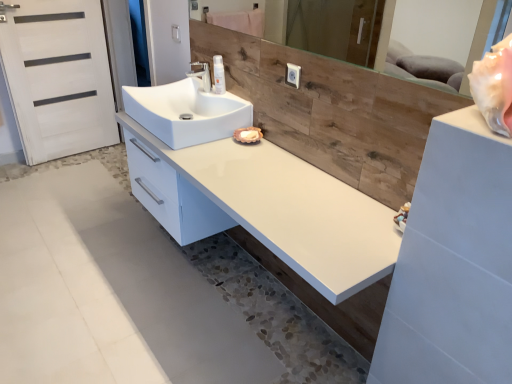
Question: From the image's perspective, is wooden mirror at upper center located beneath white glossy counter at center?

Choices:
 (A) yes
 (B) no

Answer: (B)

Question: From a real-world perspective, is wooden mirror at upper center on white glossy counter at center?

Choices:
 (A) yes
 (B) no

Answer: (A)

Question: Considering the relative positions of wooden mirror at upper center and white glossy counter at center in the image provided, is wooden mirror at upper center to the right of white glossy counter at center from the viewer's perspective?

Choices:
 (A) yes
 (B) no

Answer: (A)

Question: Is wooden mirror at upper center shorter than white glossy counter at center?

Choices:
 (A) yes
 (B) no

Answer: (A)

Question: Is wooden mirror at upper center thinner than white glossy counter at center?

Choices:
 (A) no
 (B) yes

Answer: (B)

Question: Based on their sizes in the image, would you say white glossy counter at center is bigger or smaller than white glossy spray can at center?

Choices:
 (A) small
 (B) big

Answer: (B)

Question: Considering their positions, is white glossy counter at center located in front of or behind white glossy spray can at center?

Choices:
 (A) front
 (B) behind

Answer: (A)

Question: Considering the positions of white glossy counter at center and white glossy spray can at center in the image, is white glossy counter at center taller or shorter than white glossy spray can at center?

Choices:
 (A) tall
 (B) short

Answer: (A)

Question: Is white glossy counter at center wider or thinner than white glossy spray can at center?

Choices:
 (A) thin
 (B) wide

Answer: (B)

Question: From a real-world perspective, is white glossy counter at center physically located above or below white glossy sink at center?

Choices:
 (A) above
 (B) below

Answer: (B)

Question: Does point (300, 165) appear closer or farther from the camera than point (217, 129)?

Choices:
 (A) farther
 (B) closer

Answer: (B)

Question: Looking at the image, does white glossy counter at center seem bigger or smaller compared to white glossy sink at center?

Choices:
 (A) big
 (B) small

Answer: (A)

Question: In terms of height, does white glossy counter at center look taller or shorter compared to white glossy sink at center?

Choices:
 (A) short
 (B) tall

Answer: (B)

Question: Is white glossy spray can at center taller or shorter than white matte door at left?

Choices:
 (A) tall
 (B) short

Answer: (B)

Question: Is white glossy spray can at center to the left or to the right of white matte door at left in the image?

Choices:
 (A) left
 (B) right

Answer: (B)